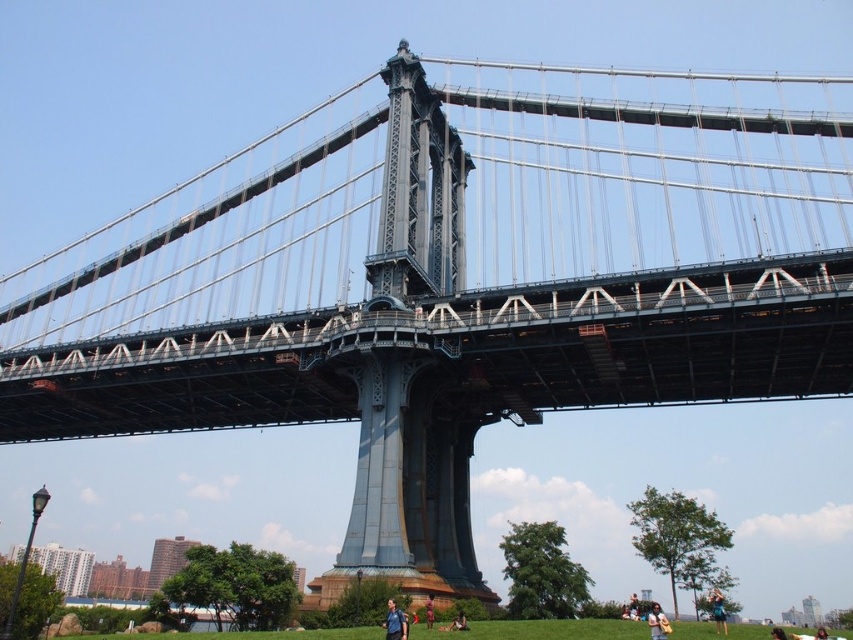
Question: Which object appears closest to the camera in this image?

Choices:
 (A) blue fabric at lower right
 (B) brown skin at lower center
 (C) blue fabric backpack at lower center

Answer: (C)

Question: Is blue fabric backpack at lower center bigger than blue denim jeans at lower center?

Choices:
 (A) yes
 (B) no

Answer: (B)

Question: Is the position of blue denim jeans at lower center less distant than that of brown skin at lower center?

Choices:
 (A) yes
 (B) no

Answer: (B)

Question: Which is farther from the light brown fabric bag at lower center?

Choices:
 (A) brown skin at lower center
 (B) blue fabric at lower right
 (C) blue denim jeans at lower center
 (D) light brown leather jacket at lower center

Answer: (A)

Question: In this image, where is blue fabric at lower right located relative to brown skin at lower center?

Choices:
 (A) below
 (B) above

Answer: (A)

Question: Which of these objects is positioned farthest from the brown skin at lower center?

Choices:
 (A) light brown leather jacket at lower center
 (B) blue fabric backpack at lower center
 (C) blue fabric at lower right
 (D) light brown fabric bag at lower center

Answer: (A)